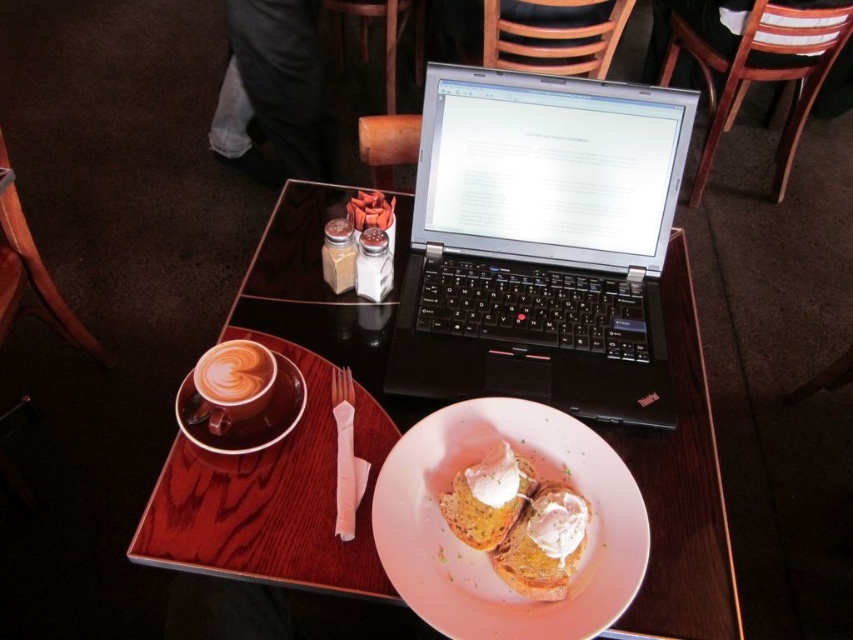
Question: Which object appears closest to the camera in this image?

Choices:
 (A) white fluffy poached egg on toasted bread at center
 (B) smooth white cream at center
 (C) white fluffy bread at center

Answer: (B)

Question: Where is wooden table at center located in relation to white fluffy bread at center in the image?

Choices:
 (A) above
 (B) below

Answer: (A)

Question: Which point is closer to the camera?

Choices:
 (A) wooden table at center
 (B) latte art at center
 (C) black plastic laptop at center
 (D) pink matte plate at center

Answer: (D)

Question: From the image, what is the correct spatial relationship of smooth white cream at center in relation to white fluffy poached egg on toasted bread at center?

Choices:
 (A) below
 (B) above

Answer: (A)

Question: Which object appears farthest from the camera in this image?

Choices:
 (A) pink matte plate at center
 (B) wooden table at center
 (C) latte art at center

Answer: (C)

Question: Does wooden table at center appear on the right side of white fluffy bread at center?

Choices:
 (A) yes
 (B) no

Answer: (B)